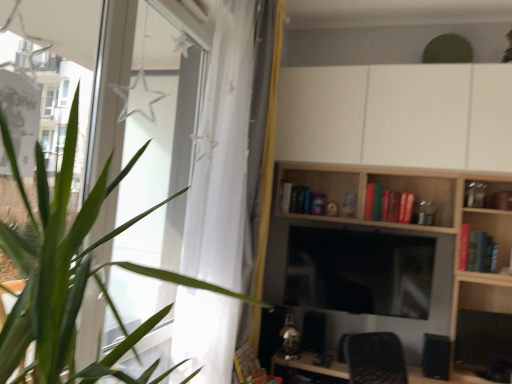
This screenshot has height=384, width=512. I want to click on blank space situated above matte black monitor at center (from a real-world perspective), so click(x=377, y=223).